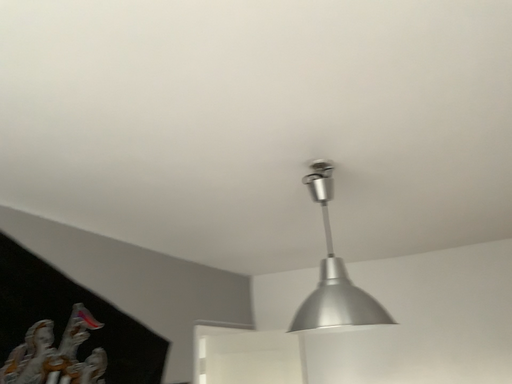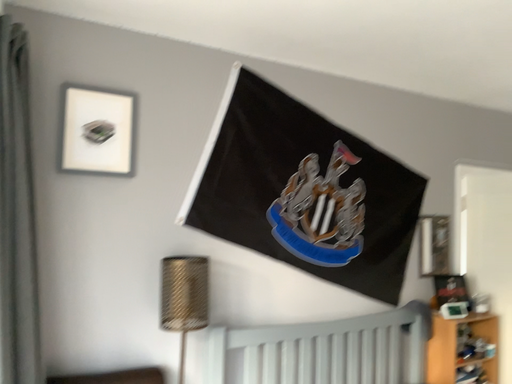
Question: Which way did the camera rotate in the video?

Choices:
 (A) rotated right
 (B) rotated left

Answer: (B)